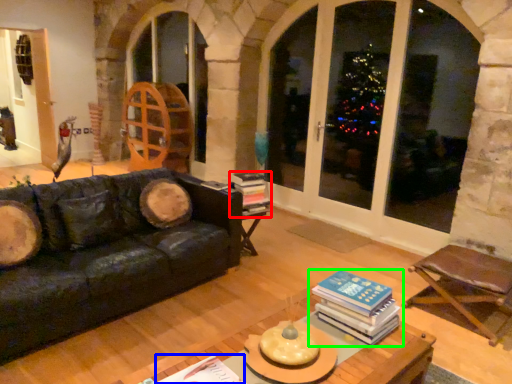
Question: Which object is positioned closest to book (highlighted by a red box)? Select from book (highlighted by a blue box) and book (highlighted by a green box).

Choices:
 (A) book
 (B) book

Answer: (B)